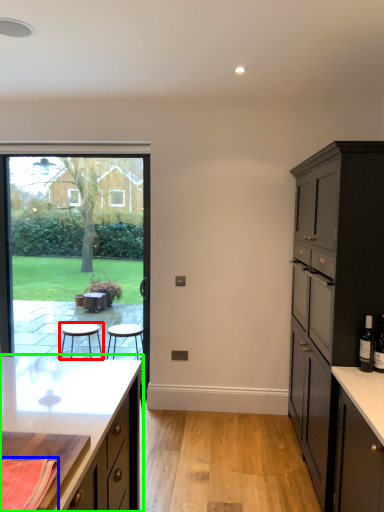
Question: Which object is the farthest from stool (highlighted by a red box)? Choose among these: material (highlighted by a blue box) or cabinetry (highlighted by a green box).

Choices:
 (A) material
 (B) cabinetry

Answer: (A)